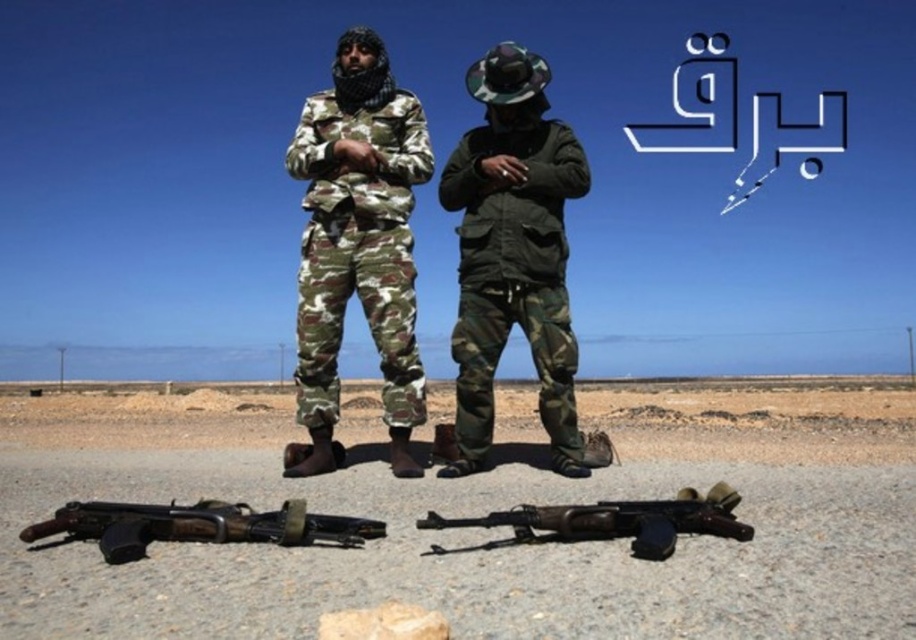
You are a photographer taking a picture of the dark green matte jacket at center and the rusty metal rifle at lower center. Which object appears narrower in the photo?

The dark green matte jacket at center appears narrower than the rusty metal rifle at lower center because it has a lesser width according to the description.

You are a photographer trying to capture a clear shot of the camo fabric uniform at center. However, the dull gray gravel at center is blocking your view. Can you determine if the gravel is in front of or behind the uniform?

The dull gray gravel at center is closer to the viewer than the camo fabric uniform at center, so the gravel is blocking the view in front of the uniform.

You are a photographer taking a picture of the camo fabric uniform at center and the rusty metal rifle at lower center. Which object should you zoom in on to ensure both are in focus, considering their sizes?

The camo fabric uniform at center is bigger than the rusty metal rifle at lower center, so you should zoom in on the camo fabric uniform at center to ensure both are in focus.